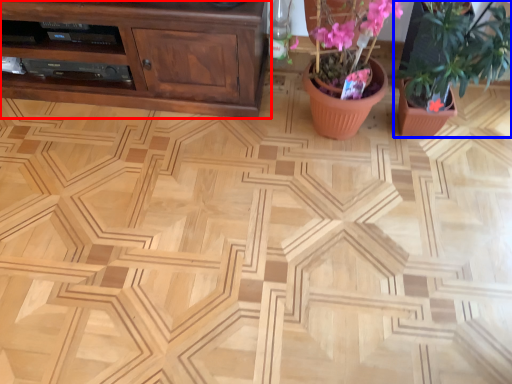
Question: Which point is further to the camera, cabinetry (highlighted by a red box) or houseplant (highlighted by a blue box)?

Choices:
 (A) cabinetry
 (B) houseplant

Answer: (A)